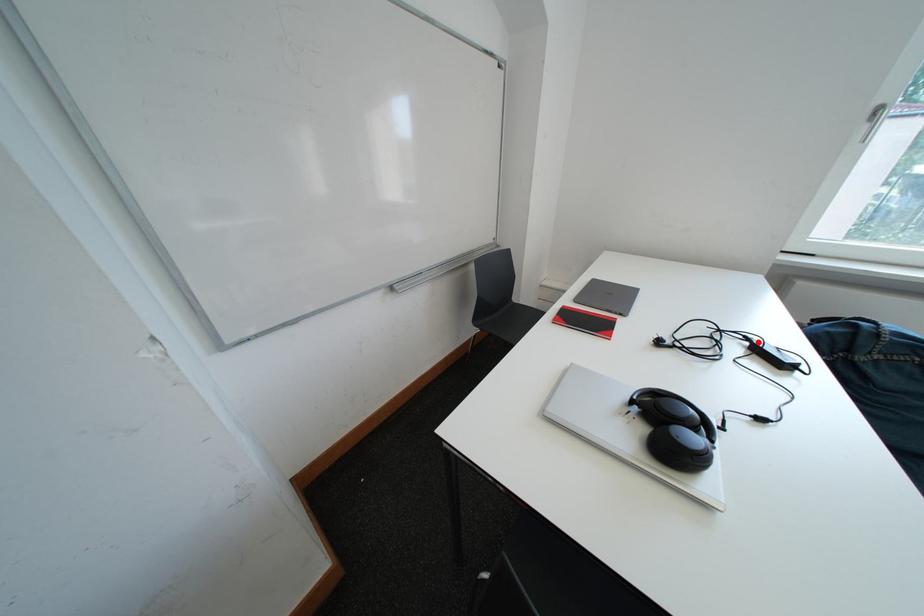
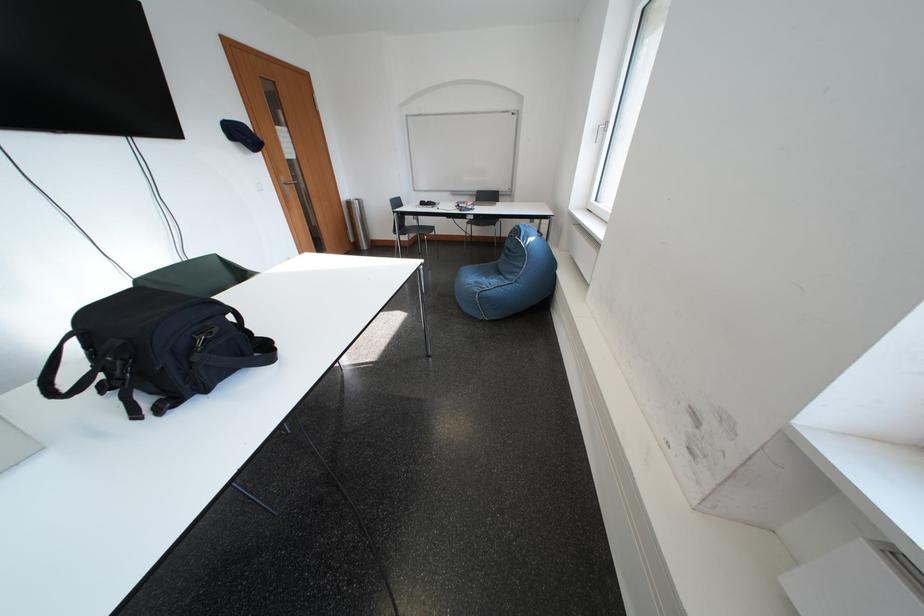
Question: I am providing you with two images of the same scene from different viewpoints. A red point is marked on the first image. At the location where the point appears in image 1, is it still visible in image 2?

Choices:
 (A) Yes
 (B) No

Answer: (B)